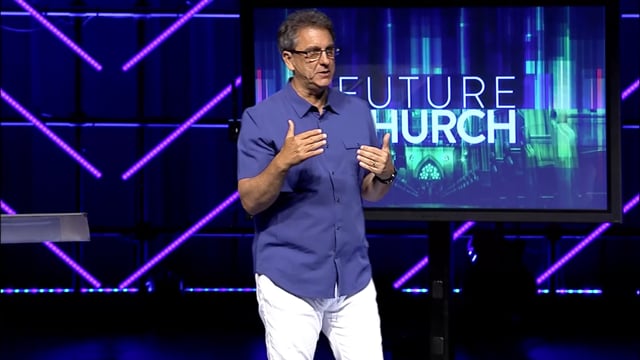
The height and width of the screenshot is (360, 640). What are the coordinates of `monitor` in the screenshot? It's located at pos(466,225).